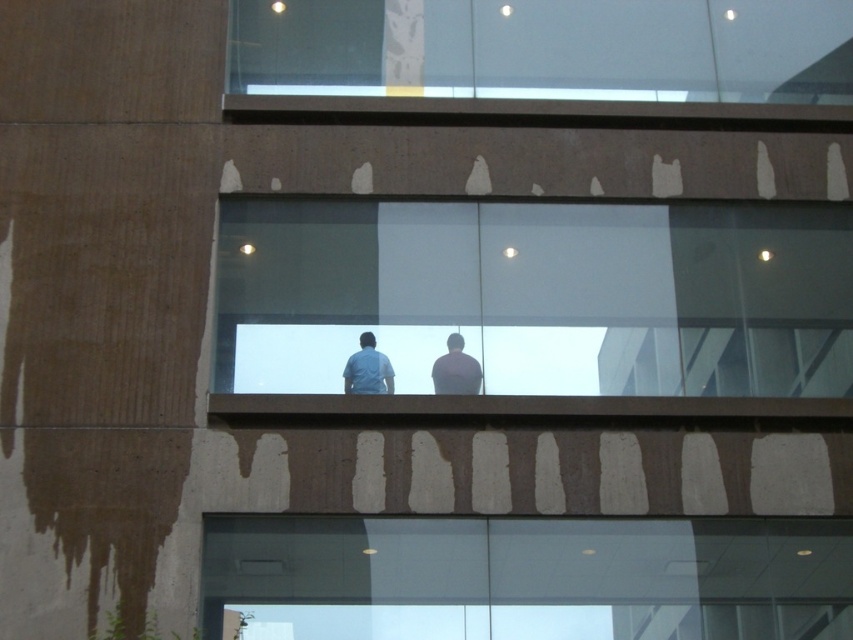
Image resolution: width=853 pixels, height=640 pixels. Identify the location of transparent glass window at center. (538, 296).

Who is more distant from viewer, (x=822, y=276) or (x=439, y=380)?

The point (x=822, y=276) is behind.

Between point (512, 228) and point (466, 353), which one is positioned in front?

Point (466, 353) is more forward.

Image resolution: width=853 pixels, height=640 pixels. Find the location of `transparent glass window at center`. transparent glass window at center is located at coordinates (538, 296).

Who is positioned more to the left, transparent glass window at lower center or smooth gray shirt at center?

Positioned to the left is smooth gray shirt at center.

Is point (782, 556) farther from camera compared to point (434, 371)?

No, it is in front of (434, 371).

Locate an element on the screen. transparent glass window at lower center is located at coordinates (526, 579).

Find the location of `transparent glass window at lower center`. transparent glass window at lower center is located at coordinates (526, 579).

Does transparent glass window at center appear on the right side of light blue shirt at center?

Yes, transparent glass window at center is to the right of light blue shirt at center.

Does point (769, 214) lie behind point (370, 387)?

That is True.

Does point (805, 364) come in front of point (352, 384)?

No.

At what (x,y) coordinates should I click in order to perform the action: click on transparent glass window at center. Please return your answer as a coordinate pair (x, y). This screenshot has height=640, width=853. Looking at the image, I should click on (538, 296).